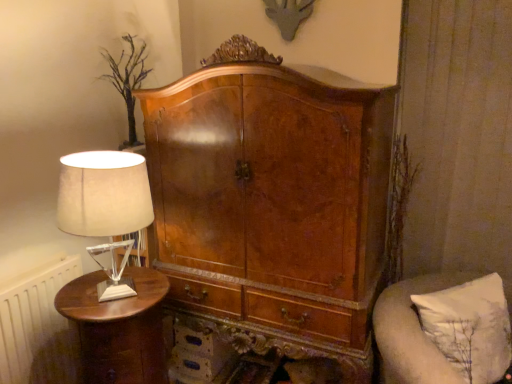
Question: From the image's perspective, is white fabric pillow at right above or below white painted radiator at left?

Choices:
 (A) above
 (B) below

Answer: (A)

Question: Choose the correct answer: Is white fabric pillow at right inside white painted radiator at left or outside it?

Choices:
 (A) outside
 (B) inside

Answer: (A)

Question: Estimate the real-world distances between objects in this image. Which object is farther from the shiny brown wood nightstand at left?

Choices:
 (A) white fabric pillow at right
 (B) white fabric lampshade at left
 (C) white painted radiator at left

Answer: (A)

Question: Estimate the real-world distances between objects in this image. Which object is closer to the white fabric pillow at right?

Choices:
 (A) shiny brown wood nightstand at left
 (B) white painted radiator at left
 (C) white fabric lampshade at left

Answer: (A)